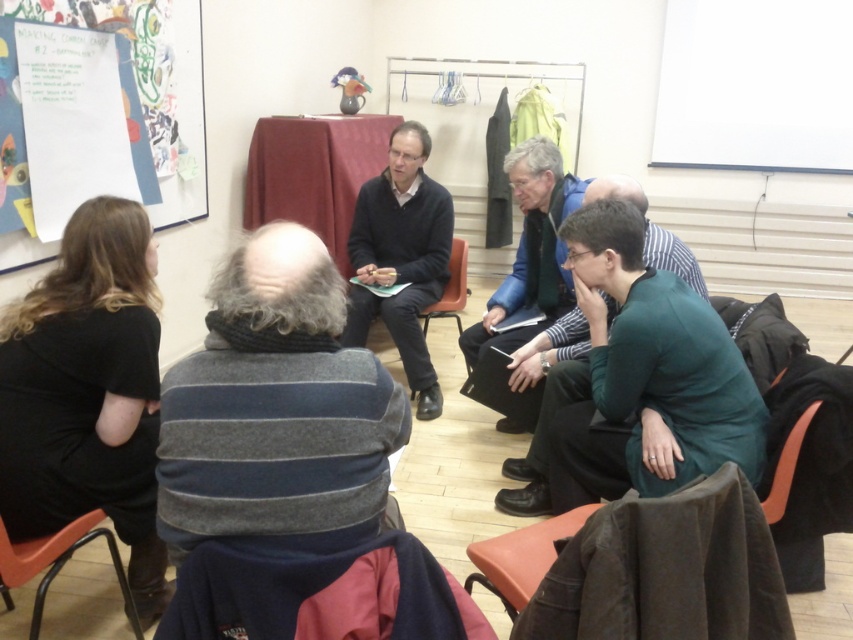
Consider the image. Based on the provided scene and the objects listed, can you determine the spatial relationship between the gray striped sweater at center and any other objects mentioned in the Objects list?

The gray striped sweater at center is located at point (276, 404), but no other objects are listed in the Objects section to compare its position with.

You are standing at the front of the classroom and want to hand out a document to the person wearing the gray striped sweater at center. If your reach is 3 feet, can you reach them without moving closer?

The gray striped sweater at center is 3.70 feet away from the camera. Since your reach is 3 feet, you cannot reach them without moving closer.